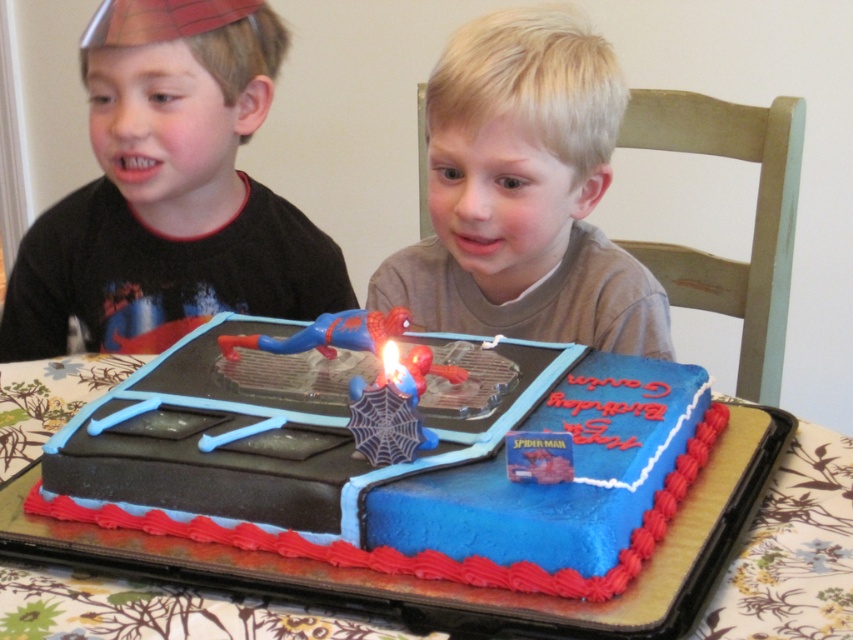
Question: Can you confirm if blonde hair at upper center is wider than blue frosted cake at center?

Choices:
 (A) no
 (B) yes

Answer: (A)

Question: Which object appears closest to the camera in this image?

Choices:
 (A) blue frosted cake at center
 (B) matte black shirt at left
 (C) blonde hair at upper center

Answer: (A)

Question: Does matte black shirt at left have a lesser width compared to blue frosted cake at center?

Choices:
 (A) yes
 (B) no

Answer: (A)

Question: Which point is farther to the camera?

Choices:
 (A) (512, 234)
 (B) (192, 61)

Answer: (B)

Question: Based on their relative distances, which object is farther from the blue frosted cake at center?

Choices:
 (A) blonde hair at upper center
 (B) matte black shirt at left

Answer: (B)

Question: Is matte black shirt at left bigger than blue frosted cake at center?

Choices:
 (A) no
 (B) yes

Answer: (B)